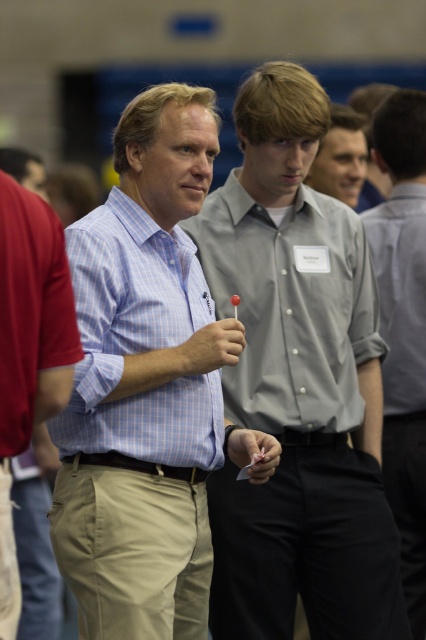
Can you confirm if light blue checkered shirt at center is bigger than gray cotton shirt at center?

Incorrect, light blue checkered shirt at center is not larger than gray cotton shirt at center.

Who is taller, light blue checkered shirt at center or gray cotton shirt at center?

gray cotton shirt at center is taller.

Consider the image. Who is more forward, [112,195] or [419,412]?

Positioned in front is point [112,195].

Find the location of a particular element. The width and height of the screenshot is (426, 640). light blue checkered shirt at center is located at coordinates (138, 340).

Is gray cotton shirt at center above gray shirt at center?

No.

Does point (408, 305) come behind point (345, 163)?

No, it is in front of (345, 163).

Find the location of a particular element. This screenshot has width=426, height=640. gray cotton shirt at center is located at coordinates (402, 328).

Who is lower down, matte gray shirt at center or khaki pants at center?

khaki pants at center is below.

In the scene shown: Between matte gray shirt at center and khaki pants at center, which one is positioned higher?

matte gray shirt at center is higher up.

The width and height of the screenshot is (426, 640). I want to click on matte gray shirt at center, so click(x=298, y=385).